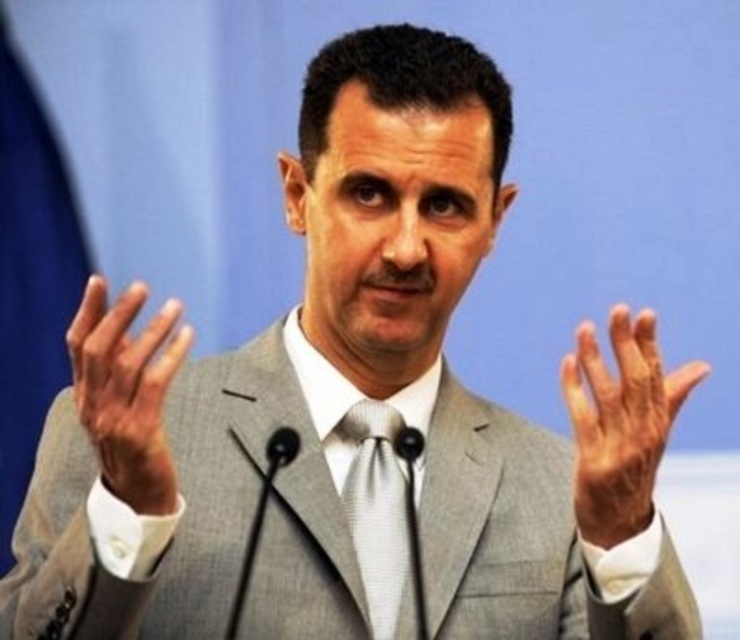
Question: Is smooth skin hand at right to the right of smooth skin hand at left from the viewer's perspective?

Choices:
 (A) no
 (B) yes

Answer: (B)

Question: Considering the real-world distances, which object is closest to the smooth skin hand at right?

Choices:
 (A) silver textured tie at center
 (B) smooth skin hand at left

Answer: (A)

Question: Does smooth skin hand at right appear on the left side of smooth skin hand at left?

Choices:
 (A) no
 (B) yes

Answer: (A)

Question: Which object is positioned farthest from the silver textured tie at center?

Choices:
 (A) smooth skin hand at left
 (B) smooth skin hand at right

Answer: (A)

Question: Which point is closer to the camera?

Choices:
 (A) silver textured tie at center
 (B) smooth skin hand at left

Answer: (B)

Question: Is smooth skin hand at right behind smooth skin hand at left?

Choices:
 (A) yes
 (B) no

Answer: (A)